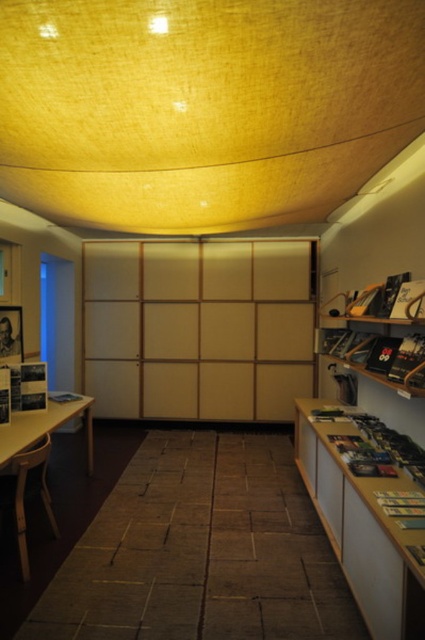
Can you confirm if wooden bookshelf at right is positioned to the left of matte wood table at lower left?

No, wooden bookshelf at right is not to the left of matte wood table at lower left.

Which is behind, point (337, 556) or point (22, 451)?

The point (22, 451) is behind.

Is point (397, 609) closer to viewer compared to point (56, 412)?

Yes, it is.

This screenshot has width=425, height=640. I want to click on wooden bookshelf at right, so click(371, 472).

Does light brown wooden table at lower left have a larger size compared to matte wood table at lower left?

Actually, light brown wooden table at lower left might be smaller than matte wood table at lower left.

Is light brown wooden table at lower left positioned in front of matte wood table at lower left?

No, it is not.

Is point (5, 438) closer to camera compared to point (50, 424)?

Yes, it is in front of point (50, 424).

The height and width of the screenshot is (640, 425). Find the location of `light brown wooden table at lower left`. light brown wooden table at lower left is located at coordinates (44, 428).

Is wooden bookshelf at right positioned in front of light brown wooden table at lower left?

Yes, wooden bookshelf at right is closer to the viewer.

I want to click on wooden bookshelf at right, so click(371, 472).

Which is in front, point (323, 419) or point (27, 444)?

Point (27, 444) is in front.

The width and height of the screenshot is (425, 640). In order to click on wooden bookshelf at right in this screenshot , I will do `click(371, 472)`.